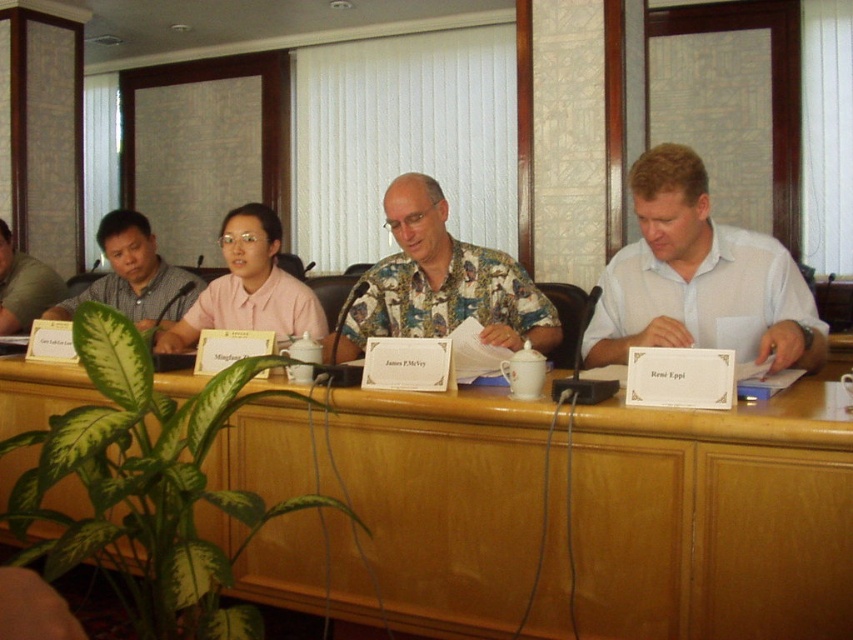
Is point (210, 312) positioned behind point (80, 296)?

No, it is not.

Find the location of `pink fabric shirt at center`. pink fabric shirt at center is located at coordinates (248, 288).

Is white cotton shirt at right to the left of brushed metal mug at left from the viewer's perspective?

In fact, white cotton shirt at right is to the right of brushed metal mug at left.

Is point (677, 244) positioned before point (51, 282)?

Yes, it is.

Where is `white cotton shirt at right`? The width and height of the screenshot is (853, 640). white cotton shirt at right is located at coordinates (698, 276).

Is pink fabric shirt at center further to the viewer compared to brushed metal mug at left?

No, pink fabric shirt at center is in front of brushed metal mug at left.

Can you confirm if pink fabric shirt at center is shorter than brushed metal mug at left?

Incorrect, pink fabric shirt at center's height does not fall short of brushed metal mug at left's.

Which is behind, point (264, 220) or point (15, 291)?

Positioned behind is point (15, 291).

You are a GUI agent. You are given a task and a screenshot of the screen. Output one action in this format:
    pyautogui.click(x=<x>, y=<y>)
    Task: Click on the pink fabric shirt at center
    
    Given the screenshot: What is the action you would take?
    pyautogui.click(x=248, y=288)